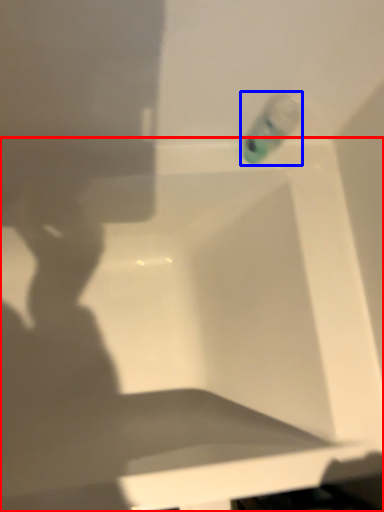
Question: Which point is closer to the camera, bathtub (highlighted by a red box) or liquid (highlighted by a blue box)?

Choices:
 (A) bathtub
 (B) liquid

Answer: (A)